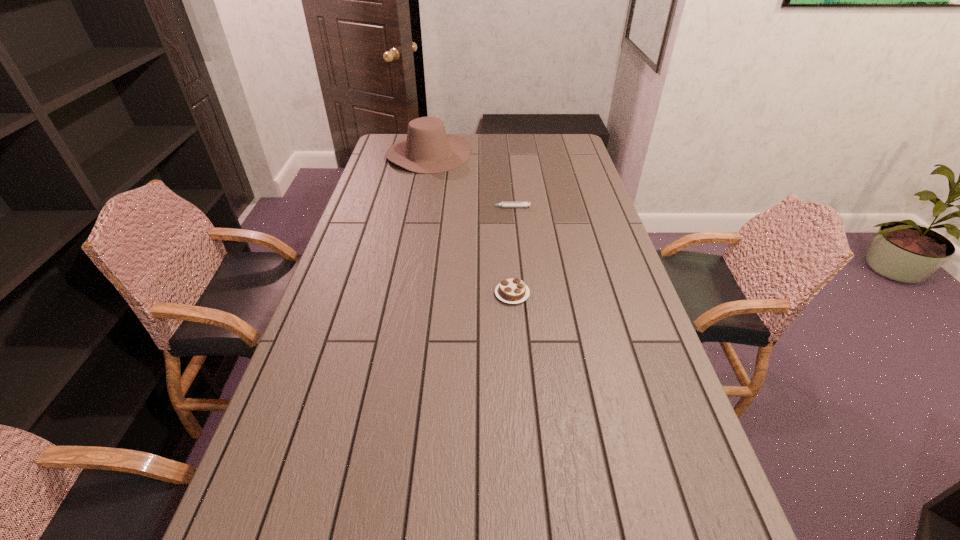
This screenshot has height=540, width=960. Find the location of `vacant space located 0.090m at the needle end of the second nearest object`. vacant space located 0.090m at the needle end of the second nearest object is located at coordinates (463, 207).

Locate an element on the screen. This screenshot has width=960, height=540. object that is at the far edge is located at coordinates (428, 149).

Where is `object present at the left edge`? object present at the left edge is located at coordinates (428, 149).

I want to click on object that is positioned at the far left corner, so click(x=428, y=149).

You are a GUI agent. You are given a task and a screenshot of the screen. Output one action in this format:
    pyautogui.click(x=<x>, y=<y>)
    Task: Click on the vacant point at the far edge
    
    Given the screenshot: What is the action you would take?
    pyautogui.click(x=485, y=142)

At what (x,y) coordinates should I click in order to perform the action: click on vacant region at the left edge of the desktop. Please return your answer as a coordinate pair (x, y). The height and width of the screenshot is (540, 960). Looking at the image, I should click on (373, 195).

This screenshot has height=540, width=960. In the image, there is a desktop. Identify the location of free region at the right edge. (597, 216).

Locate an element on the screen. Image resolution: width=960 pixels, height=540 pixels. empty space that is in between the chocolate cake and the syringe is located at coordinates (511, 251).

The height and width of the screenshot is (540, 960). I want to click on vacant space in between the farthest object and the nearest object, so click(x=470, y=224).

Locate an element on the screen. object identified as the second closest to the cowboy hat is located at coordinates (514, 290).